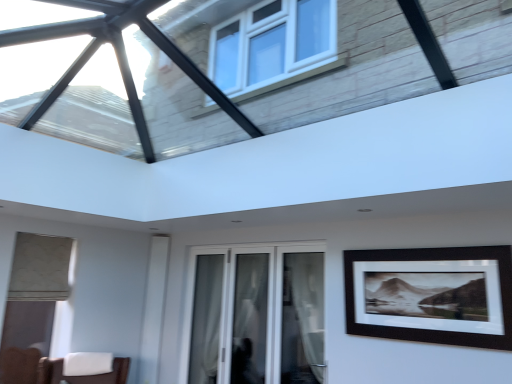
Question: From a real-world perspective, relative to white sheer curtain at center, which is counted as the 2th curtain, starting from the right, is black matte picture frame at right vertically above or below?

Choices:
 (A) above
 (B) below

Answer: (A)

Question: Based on their sizes in the image, would you say black matte picture frame at right is bigger or smaller than white sheer curtain at center, which is the first curtain from back to front?

Choices:
 (A) big
 (B) small

Answer: (A)

Question: Estimate the real-world distances between objects in this image. Which object is closer to the white sheer curtain at center, positioned as the second curtain in back-to-front order?

Choices:
 (A) black matte picture frame at right
 (B) white glass door at center
 (C) white sheer curtain at center, which is the first curtain from back to front

Answer: (B)

Question: Considering the real-world distances, which object is farthest from the black matte picture frame at right?

Choices:
 (A) white sheer curtain at center, positioned as the second curtain in front-to-back order
 (B) white sheer curtain at center, which is counted as the first curtain, starting from the right
 (C) white glass door at center

Answer: (A)